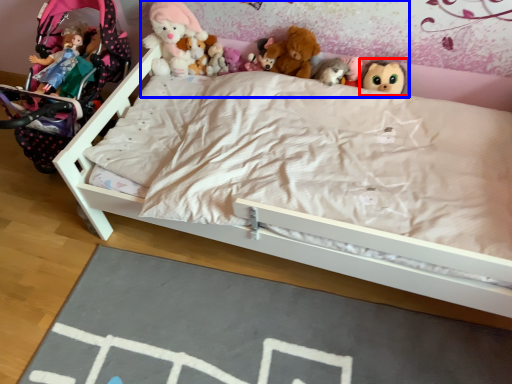
Question: Among these objects, which one is farthest to the camera, toy (highlighted by a red box) or collection (highlighted by a blue box)?

Choices:
 (A) toy
 (B) collection

Answer: (A)